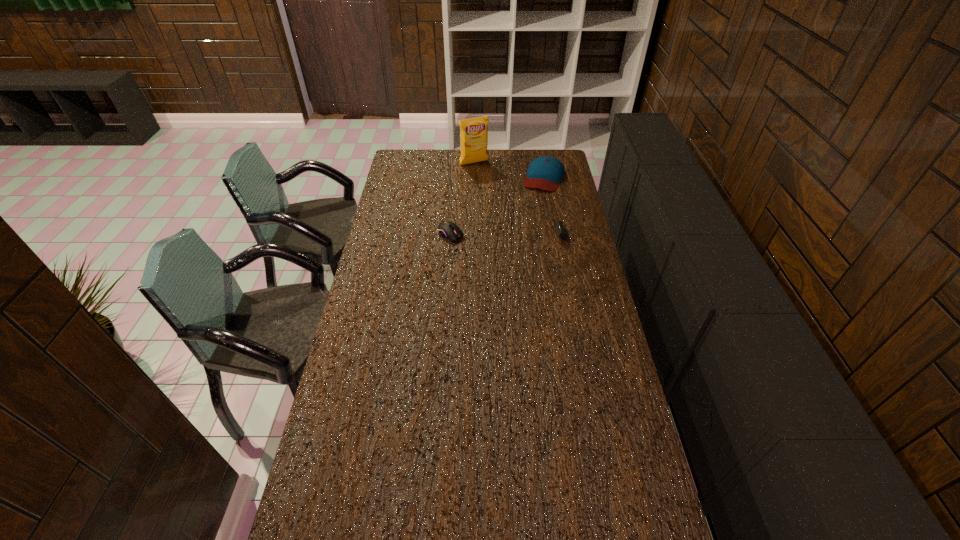
Image resolution: width=960 pixels, height=540 pixels. In order to click on vacant space in between the baseball cap and the tallest object in this screenshot , I will do `click(509, 170)`.

Locate an element on the screen. unoccupied area between the baseball cap and the computer mouse is located at coordinates pyautogui.click(x=497, y=206).

This screenshot has height=540, width=960. I want to click on empty space between the third shortest object and the tallest object, so click(x=509, y=170).

Where is `free spot between the baseball cap and the computer mouse`? free spot between the baseball cap and the computer mouse is located at coordinates (497, 206).

Locate an element on the screen. object identified as the closest to the computer mouse is located at coordinates click(x=545, y=172).

Locate which object is the closest to the crisp (potato chip). Please provide its 2D coordinates. Your answer should be formatted as a tuple, i.e. [(x, y)], where the tuple contains the x and y coordinates of a point satisfying the conditions above.

[(545, 172)]

The image size is (960, 540). In order to click on free space that satisfies the following two spatial constraints: 1. on the front side of the tallest object; 2. on the front-facing side of the webcam in this screenshot , I will do `click(472, 234)`.